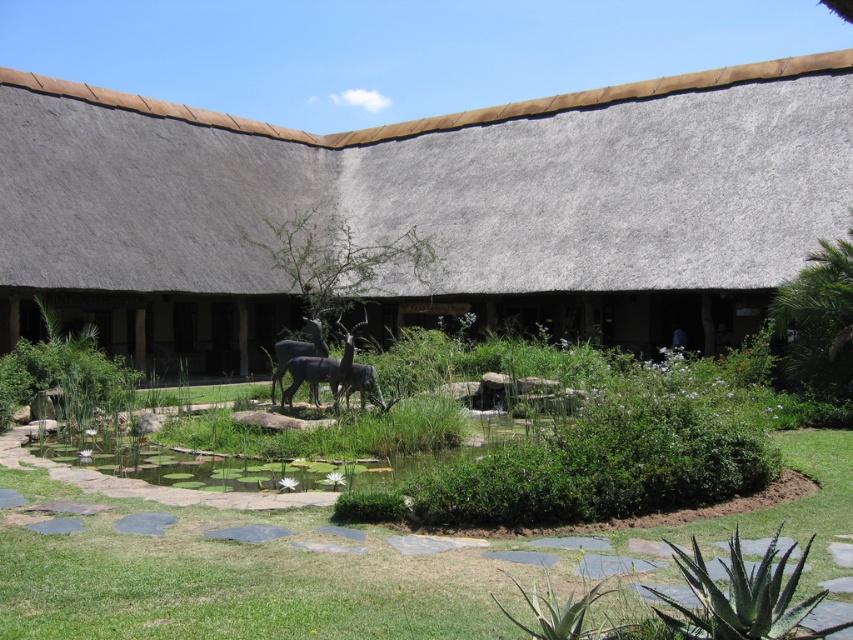
In the scene shown: Does metallic gray statue at center have a greater width compared to polished bronze statue at center?

No, metallic gray statue at center is not wider than polished bronze statue at center.

Does metallic gray statue at center have a smaller size compared to polished bronze statue at center?

Indeed, metallic gray statue at center has a smaller size compared to polished bronze statue at center.

Does point (274, 387) lie in front of point (376, 384)?

No, (274, 387) is further to viewer.

Identify the location of metallic gray statue at center. Image resolution: width=853 pixels, height=640 pixels. (297, 352).

This screenshot has height=640, width=853. Describe the element at coordinates (254, 568) in the screenshot. I see `green grass at center` at that location.

Which of these two, green grass at center or metallic gray statue at center, stands shorter?

With less height is green grass at center.

This screenshot has width=853, height=640. What do you see at coordinates (254, 568) in the screenshot? I see `green grass at center` at bounding box center [254, 568].

You are a GUI agent. You are given a task and a screenshot of the screen. Output one action in this format:
    pyautogui.click(x=<x>, y=<y>)
    Task: Click on the green grass at center
    
    Given the screenshot: What is the action you would take?
    pyautogui.click(x=254, y=568)

Is point (310, 589) positioned after point (293, 369)?

No, (310, 589) is closer to viewer.

Between green grass at center and gray stone statue at center, which one appears on the left side from the viewer's perspective?

Positioned to the left is green grass at center.

Who is more distant from viewer, (210, 564) or (346, 371)?

The point (346, 371) is more distant.

You are a GUI agent. You are given a task and a screenshot of the screen. Output one action in this format:
    pyautogui.click(x=<x>, y=<y>)
    Task: Click on the green grass at center
    The width and height of the screenshot is (853, 640).
    Given the screenshot: What is the action you would take?
    pyautogui.click(x=254, y=568)